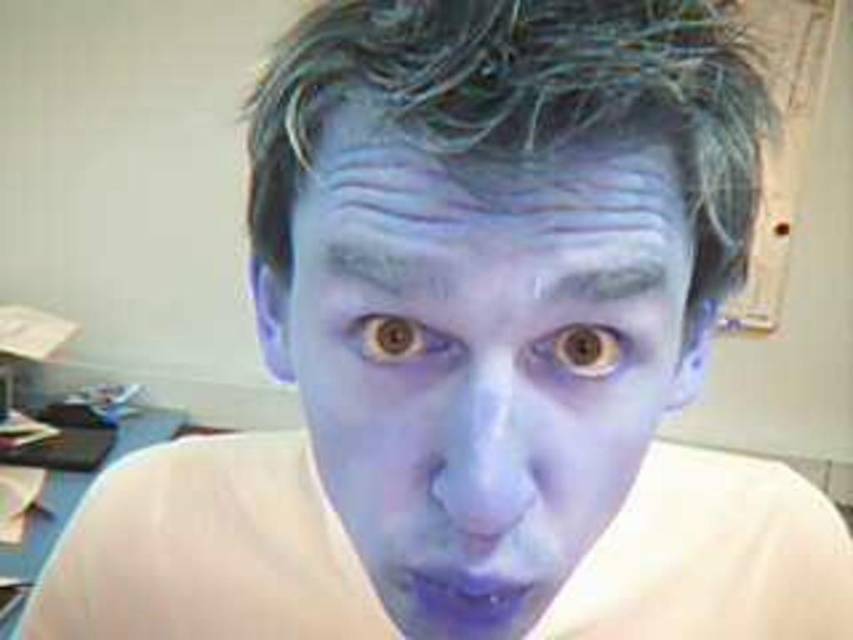
Question: Based on their relative distances, which object is farther from the gray matte eyebrow at upper center?

Choices:
 (A) blue matte face at center
 (B) blue matte hair at center
 (C) matte blue eyebrow at center

Answer: (B)

Question: Is matte blue eyebrow at center smaller than matte blue eye at center?

Choices:
 (A) yes
 (B) no

Answer: (B)

Question: Does blue matte hair at center have a lesser width compared to matte blue eye at center?

Choices:
 (A) no
 (B) yes

Answer: (A)

Question: Which point is farther to the camera?

Choices:
 (A) (425, 332)
 (B) (570, 337)

Answer: (B)

Question: Among these objects, which one is farthest from the camera?

Choices:
 (A) matte blue eye at center
 (B) gray matte eyebrow at upper center

Answer: (A)

Question: Where is blue matte hair at center located in relation to gray matte eyebrow at upper center in the image?

Choices:
 (A) left
 (B) right

Answer: (A)